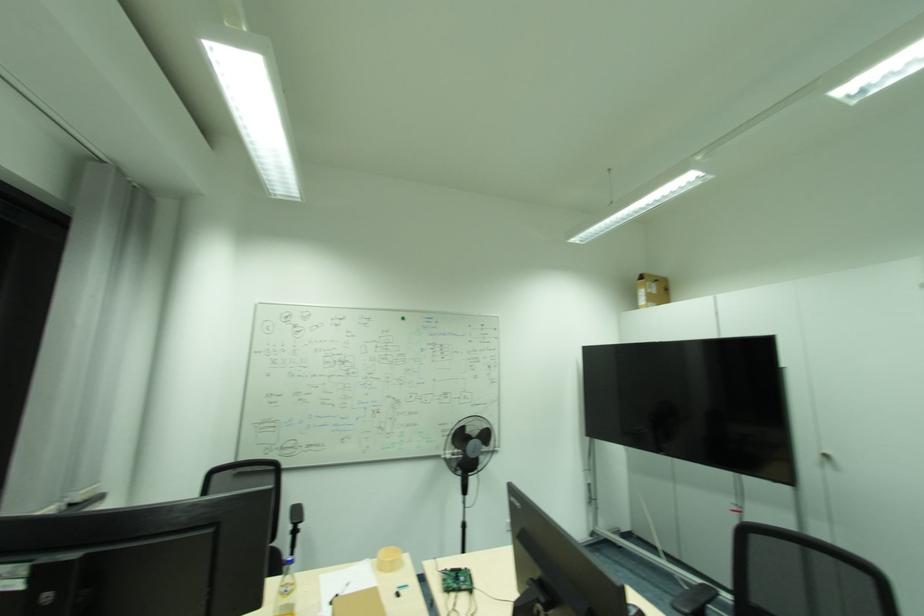
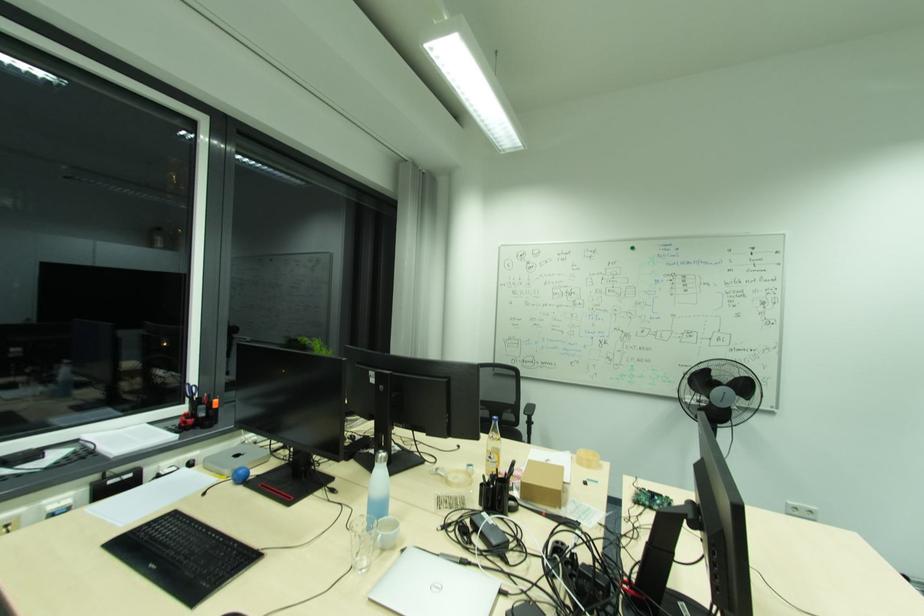
Locate, in the second image, the point that corresponds to point 491,436 in the first image.

(748, 387)